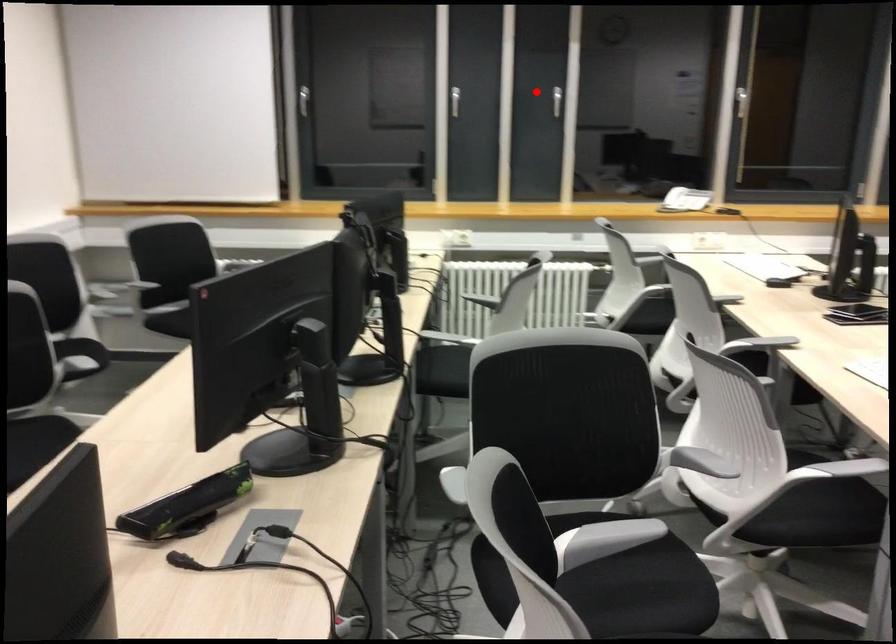
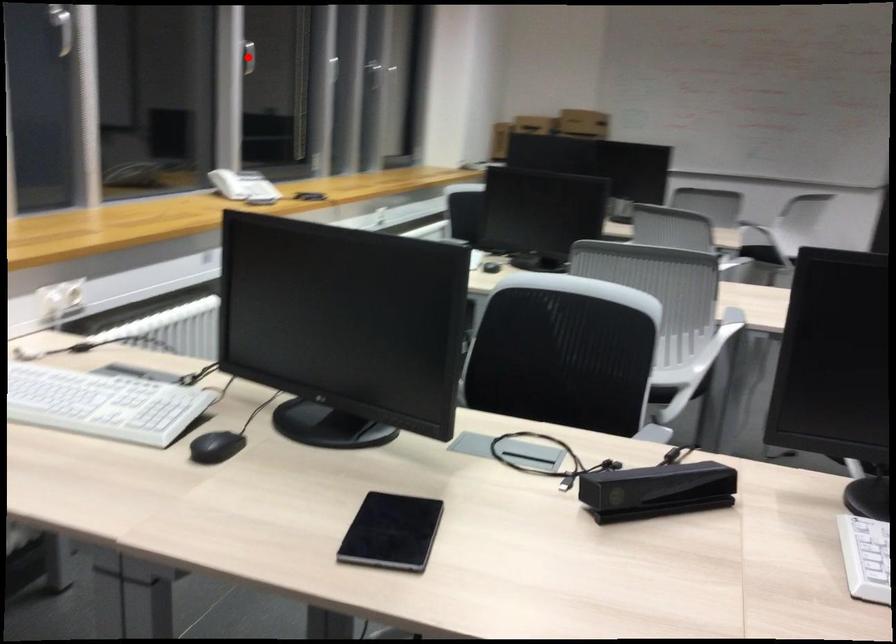
Based on the photo, I am providing you with two images of the same scene from different viewpoints. A red point is marked on the first image and another point is marked on the second image. Is the marked point in image1 the same physical position as the marked point in image2?

No